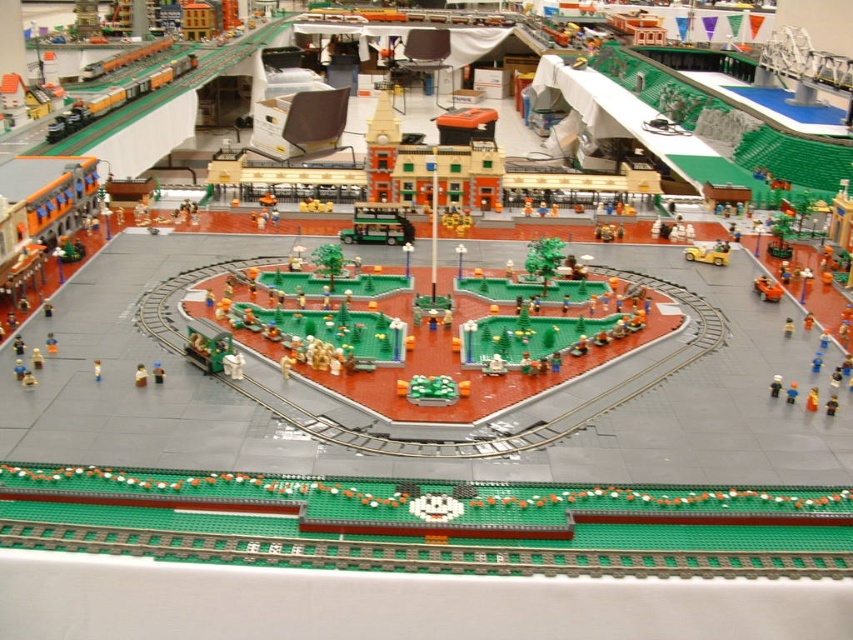
Is shiny orange car at center thinner than matte yellow figure at center?

Incorrect, shiny orange car at center's width is not less than matte yellow figure at center's.

Who is more forward, (759, 280) or (97, 371)?

Point (97, 371) is in front.

Measure the distance between shiny orange car at center and camera.

shiny orange car at center and camera are 2.86 meters apart.

At what (x,y) coordinates should I click in order to perform the action: click on shiny orange car at center. Please return your answer as a coordinate pair (x, y). The height and width of the screenshot is (640, 853). Looking at the image, I should click on (767, 289).

Who is positioned more to the left, green matte bus at center or shiny orange car at center?

From the viewer's perspective, green matte bus at center appears more on the left side.

Does green matte bus at center lie behind shiny orange car at center?

Yes, it is behind shiny orange car at center.

Does point (351, 236) come closer to viewer compared to point (759, 289)?

No, it is behind (759, 289).

You are a GUI agent. You are given a task and a screenshot of the screen. Output one action in this format:
    pyautogui.click(x=<x>, y=<y>)
    Task: Click on the green matte bus at center
    
    Given the screenshot: What is the action you would take?
    pyautogui.click(x=378, y=225)

The height and width of the screenshot is (640, 853). I want to click on yellow matte car at center, so click(x=708, y=252).

Is yellow matte car at center to the left of light brown plastic minifigure at lower center from the viewer's perspective?

Incorrect, yellow matte car at center is not on the left side of light brown plastic minifigure at lower center.

Is point (724, 246) closer to camera compared to point (135, 376)?

No, it is behind (135, 376).

Identify the location of yellow matte car at center. The image size is (853, 640). (708, 252).